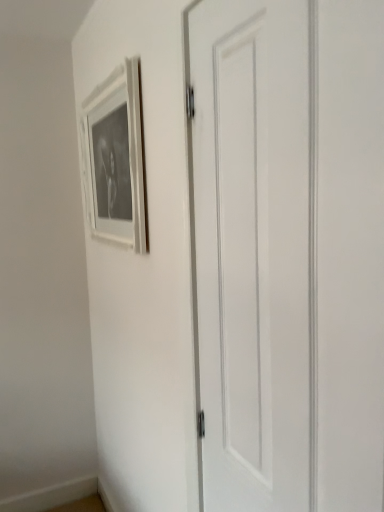
Question: In terms of size, does white matte picture frame at upper left appear bigger or smaller than white matte door at center?

Choices:
 (A) big
 (B) small

Answer: (B)

Question: Visually, is white matte picture frame at upper left positioned to the left or to the right of white matte door at center?

Choices:
 (A) left
 (B) right

Answer: (A)

Question: In terms of height, does white matte picture frame at upper left look taller or shorter compared to white matte door at center?

Choices:
 (A) tall
 (B) short

Answer: (B)

Question: Considering the positions of white matte door at center and white matte picture frame at upper left in the image, is white matte door at center taller or shorter than white matte picture frame at upper left?

Choices:
 (A) tall
 (B) short

Answer: (A)

Question: Considering the positions of white matte door at center and white matte picture frame at upper left in the image, is white matte door at center bigger or smaller than white matte picture frame at upper left?

Choices:
 (A) big
 (B) small

Answer: (A)

Question: In terms of width, does white matte door at center look wider or thinner when compared to white matte picture frame at upper left?

Choices:
 (A) wide
 (B) thin

Answer: (B)

Question: From a real-world perspective, is white matte door at center positioned above or below white matte picture frame at upper left?

Choices:
 (A) below
 (B) above

Answer: (A)